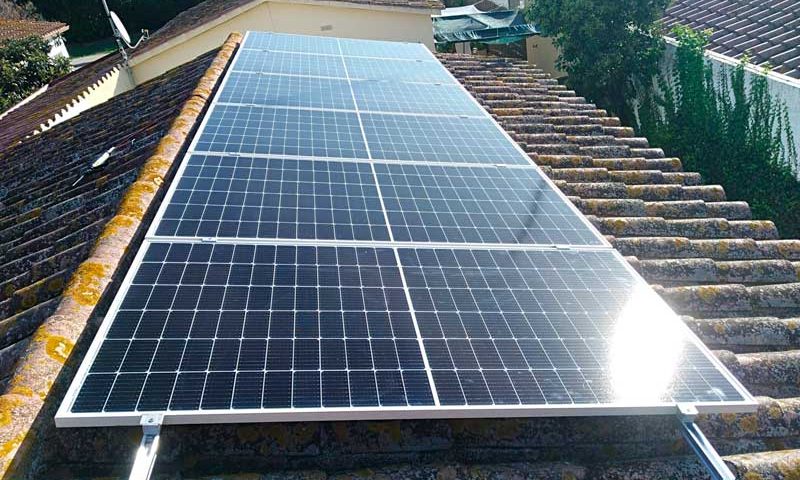
Where is `holes in the wall`? This screenshot has height=480, width=800. holes in the wall is located at coordinates (328, 29).